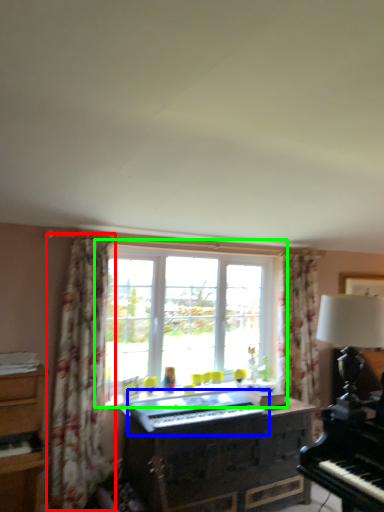
Question: Which is farther away from curtain (highlighted by a red box)? musical keyboard (highlighted by a blue box) or window (highlighted by a green box)?

Choices:
 (A) musical keyboard
 (B) window

Answer: (B)